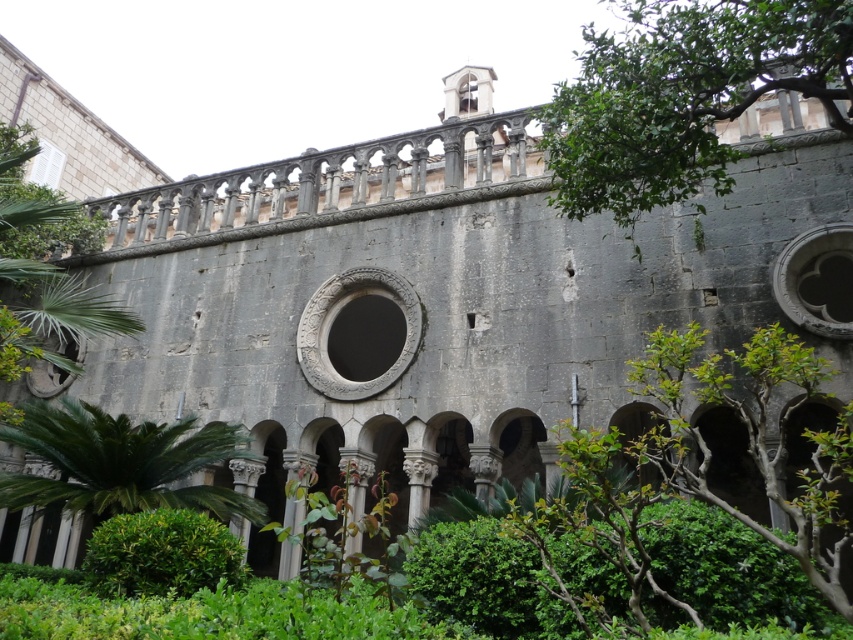
Image resolution: width=853 pixels, height=640 pixels. What are the coordinates of `green leafy tree at upper right` in the screenshot? It's located at (683, 97).

How much distance is there between green leafy tree at upper right and green leafy bush at lower center?

33.61 meters

Describe the element at coordinates (683, 97) in the screenshot. The width and height of the screenshot is (853, 640). I see `green leafy tree at upper right` at that location.

This screenshot has width=853, height=640. Find the location of `green leafy tree at upper right`. green leafy tree at upper right is located at coordinates (x=683, y=97).

Which is behind, point (32, 410) or point (10, 337)?

The point (32, 410) is behind.

Does green leafy plant at lower left appear under green leafy tree at upper left?

Yes, green leafy plant at lower left is below green leafy tree at upper left.

At what (x,y) coordinates should I click in order to perform the action: click on green leafy plant at lower left. Please return your answer as a coordinate pair (x, y). The height and width of the screenshot is (640, 853). Looking at the image, I should click on (120, 461).

Where is `green leafy plant at lower left`? The image size is (853, 640). green leafy plant at lower left is located at coordinates (120, 461).

Is green leafy tree at upper right smaller than green leafy plant at lower left?

No.

Between green leafy tree at upper right and green leafy plant at lower left, which one is positioned higher?

green leafy tree at upper right

The height and width of the screenshot is (640, 853). Identify the location of green leafy tree at upper right. (683, 97).